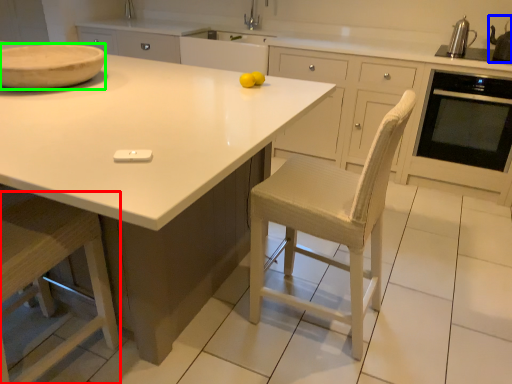
Question: Which object is the closest to the step stool (highlighted by a red box)? Choose among these: appliance (highlighted by a blue box) or bowl (highlighted by a green box).

Choices:
 (A) appliance
 (B) bowl

Answer: (B)